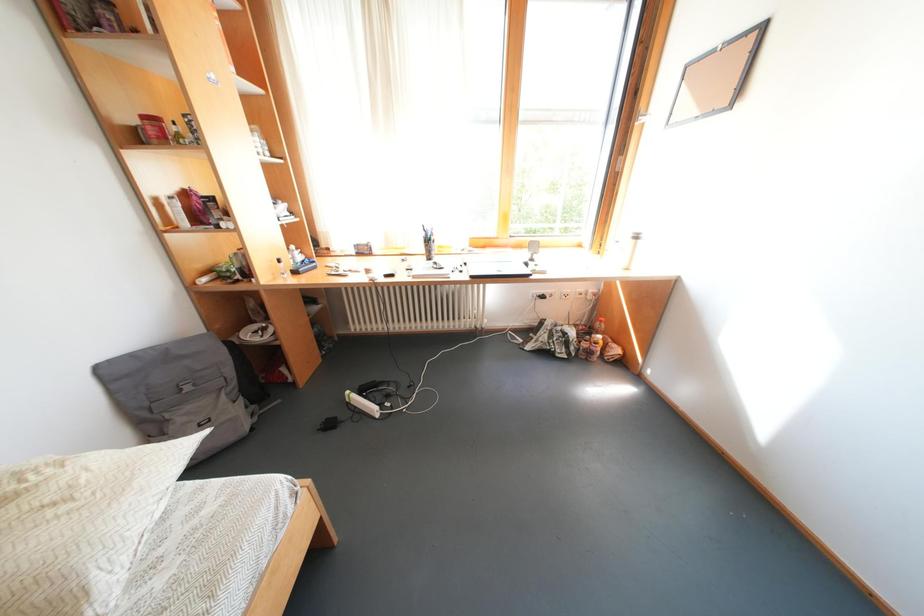
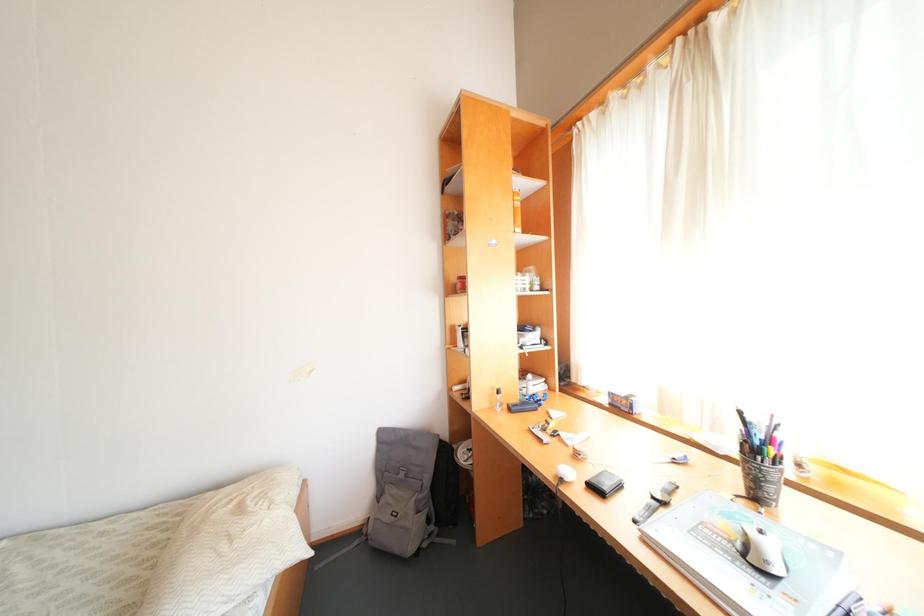
Question: The camera is either moving clockwise (left) or counter-clockwise (right) around the object. The first image is from the beginning of the video and the second image is from the end. Is the camera moving left or right when shooting the video?

Choices:
 (A) Left
 (B) Right

Answer: (B)